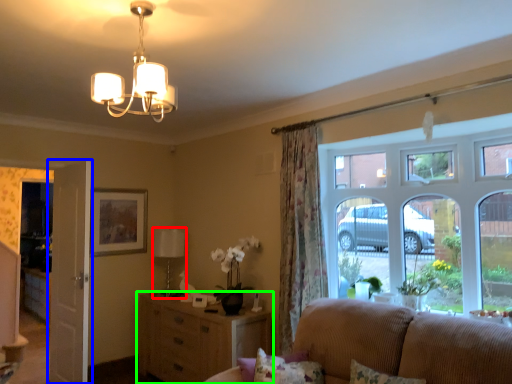
Question: Considering the real-world distances, which object is closest to lamp (highlighted by a red box)? door (highlighted by a blue box) or cabinetry (highlighted by a green box).

Choices:
 (A) door
 (B) cabinetry

Answer: (B)